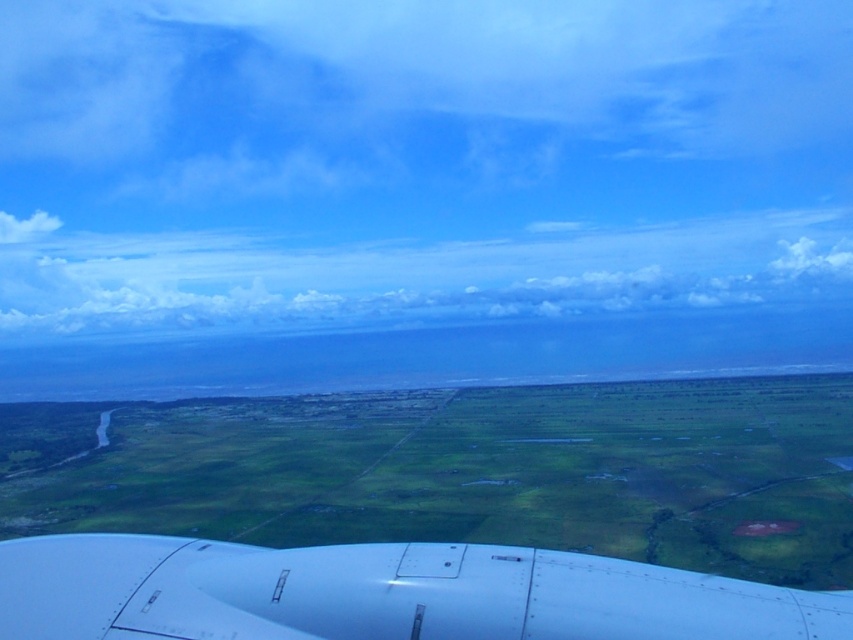
Does green grassland at center appear on the left side of cloudy sky at upper center?

Indeed, green grassland at center is positioned on the left side of cloudy sky at upper center.

Who is taller, green grassland at center or cloudy sky at upper center?

With more height is green grassland at center.

What are the coordinates of `green grassland at center` in the screenshot? It's located at (465, 470).

Measure the distance between green grassland at center and white matte airplane wing at bottom.

green grassland at center is 677.92 meters away from white matte airplane wing at bottom.

Is green grassland at center to the right of white matte airplane wing at bottom from the viewer's perspective?

Incorrect, green grassland at center is not on the right side of white matte airplane wing at bottom.

Is point (136, 449) farther from camera compared to point (676, 584)?

Yes, point (136, 449) is behind point (676, 584).

Find the location of a particular element. green grassland at center is located at coordinates (465, 470).

Can you confirm if cloudy sky at upper center is thinner than white matte airplane wing at bottom?

No.

Is cloudy sky at upper center shorter than white matte airplane wing at bottom?

Incorrect, cloudy sky at upper center's height does not fall short of white matte airplane wing at bottom's.

What are the coordinates of `cloudy sky at upper center` in the screenshot? It's located at (404, 275).

You are a GUI agent. You are given a task and a screenshot of the screen. Output one action in this format:
    pyautogui.click(x=<x>, y=<y>)
    Task: Click on the cloudy sky at upper center
    
    Given the screenshot: What is the action you would take?
    pyautogui.click(x=404, y=275)